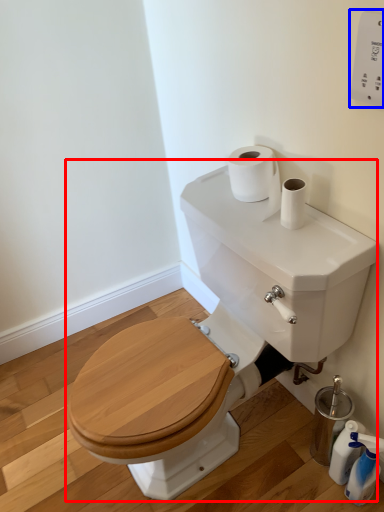
Question: Which object appears farthest to the camera in this image, sink (highlighted by a red box) or electric outlet (highlighted by a blue box)?

Choices:
 (A) sink
 (B) electric outlet

Answer: (B)